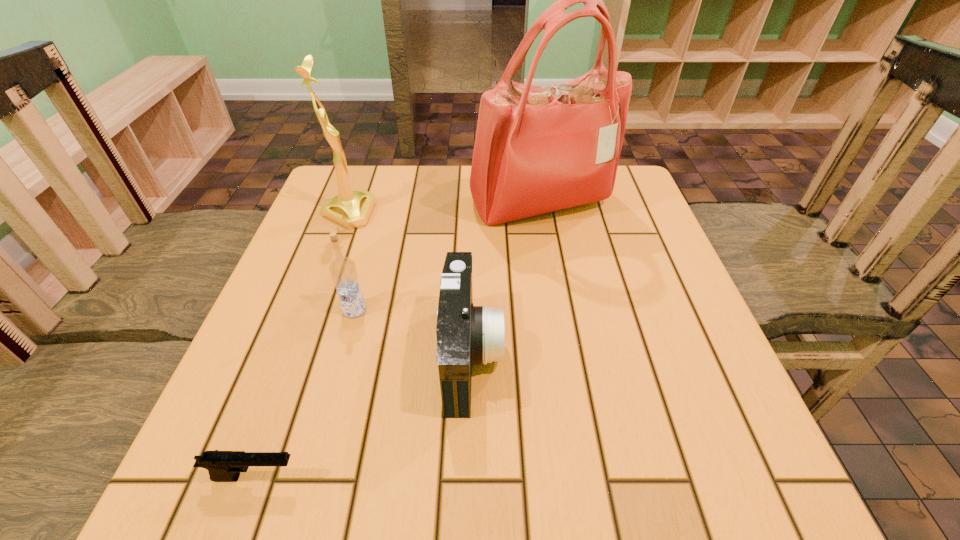
The height and width of the screenshot is (540, 960). I want to click on object positioned at the far right corner, so click(x=538, y=149).

Where is `vacant space at the far edge of the desktop`? The image size is (960, 540). vacant space at the far edge of the desktop is located at coordinates (413, 173).

In the image, there is a desktop. Find the location of `vacant space at the near edge`. vacant space at the near edge is located at coordinates (515, 465).

The image size is (960, 540). In the image, there is a desktop. In order to click on vacant area at the left edge in this screenshot , I will do `click(293, 259)`.

Where is `free region at the right edge`? The image size is (960, 540). free region at the right edge is located at coordinates (654, 344).

Identify the location of vacant space at the far left corner. (328, 185).

What are the coordinates of `vacant space that's between the fourth tallest object and the handbag` in the screenshot? It's located at (506, 280).

This screenshot has width=960, height=540. Find the location of `empty space that is in between the award and the camcorder`. empty space that is in between the award and the camcorder is located at coordinates (410, 285).

You are a GUI agent. You are given a task and a screenshot of the screen. Output one action in this format:
    pyautogui.click(x=<x>, y=<y>)
    Task: Click on the free area in between the tallest object and the nearest object
    This screenshot has width=960, height=540.
    Given the screenshot: What is the action you would take?
    pyautogui.click(x=397, y=341)

Identify the location of blank region between the fourth shortest object and the handbag. (444, 209).